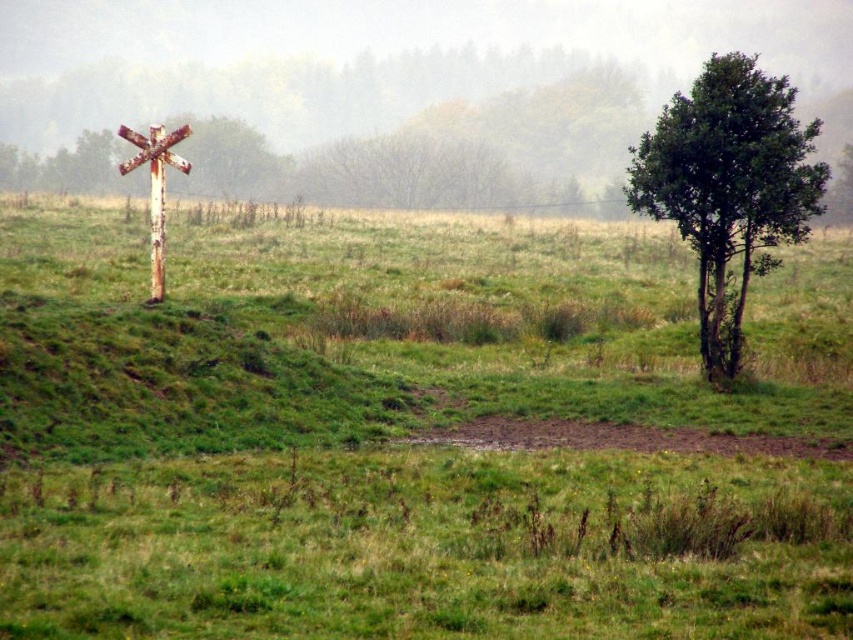
Does point (743, 61) come farther from viewer compared to point (155, 189)?

No.

Between point (693, 115) and point (155, 236), which one is positioned in front?

Point (693, 115)

At what (x,y) coordinates should I click in order to perform the action: click on green leafy tree at right. Please return your answer as a coordinate pair (x, y). Looking at the image, I should click on (729, 188).

You are a GUI agent. You are given a task and a screenshot of the screen. Output one action in this format:
    pyautogui.click(x=<x>, y=<y>)
    Task: Click on the green leafy tree at right
    This screenshot has height=640, width=853.
    Given the screenshot: What is the action you would take?
    point(729,188)

Where is `green leafy tree at right`? green leafy tree at right is located at coordinates click(729, 188).

Identify the location of green leafy tree at right. Image resolution: width=853 pixels, height=640 pixels. (729, 188).

Which of these two, rusty metal cross at left or rusty metal telegraph pole at left, stands taller?

With more height is rusty metal cross at left.

Image resolution: width=853 pixels, height=640 pixels. Describe the element at coordinates (155, 188) in the screenshot. I see `rusty metal cross at left` at that location.

Does point (173, 141) come farther from viewer compared to point (158, 280)?

Yes, point (173, 141) is behind point (158, 280).

This screenshot has height=640, width=853. What are the coordinates of `rusty metal cross at left` in the screenshot? It's located at (155, 188).